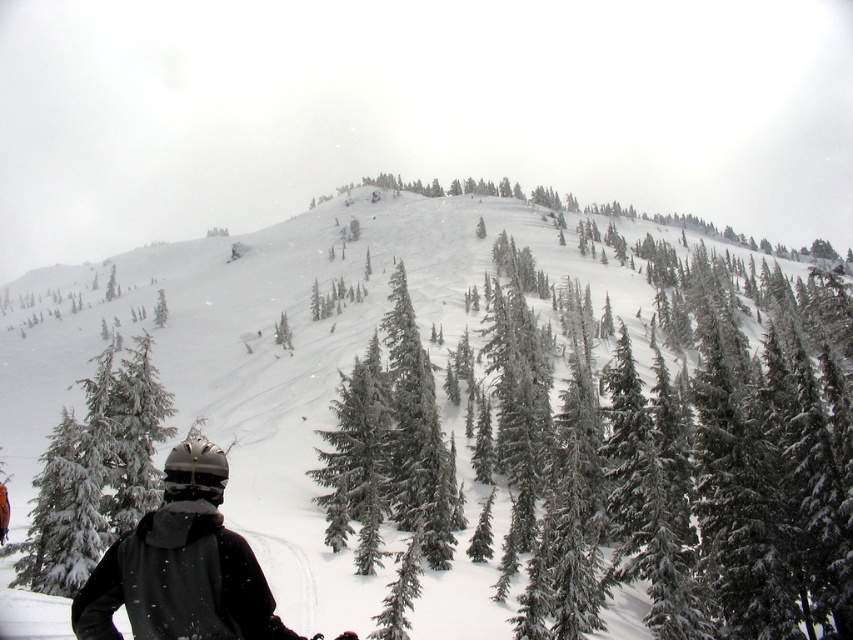
Looking at this image, is white fluffy snow at center wider than snow-covered evergreen tree at lower left?

Yes.

Is white fluffy snow at center to the right of snow-covered evergreen tree at lower left from the viewer's perspective?

Yes, white fluffy snow at center is to the right of snow-covered evergreen tree at lower left.

Where is `white fluffy snow at center`? white fluffy snow at center is located at coordinates (492, 420).